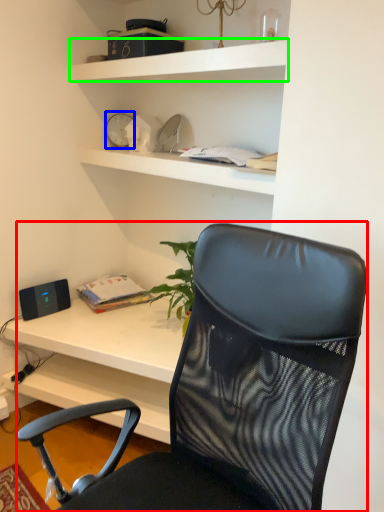
Question: Which is farther away from chair (highlighted by a red box)? clock (highlighted by a blue box) or shelf (highlighted by a green box)?

Choices:
 (A) clock
 (B) shelf

Answer: (A)